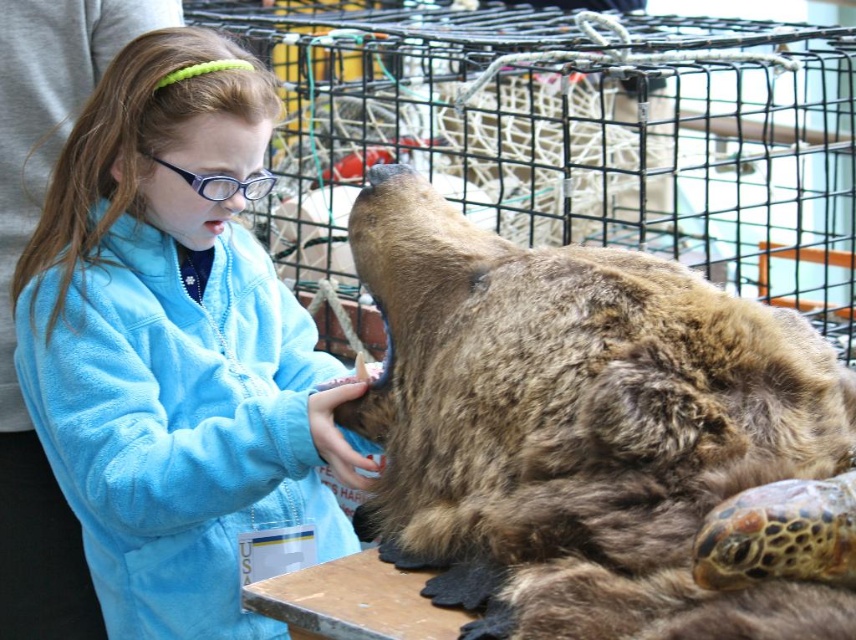
Question: Is brown furry bear at center above blue fleece jacket at upper left?

Choices:
 (A) yes
 (B) no

Answer: (B)

Question: Does brown furry bear at center have a smaller size compared to blue fleece jacket at upper left?

Choices:
 (A) no
 (B) yes

Answer: (A)

Question: Is brown furry bear at center wider than blue fleece jacket at upper left?

Choices:
 (A) yes
 (B) no

Answer: (A)

Question: Which of the following is the farthest from the observer?

Choices:
 (A) brown furry bear at center
 (B) blue fleece jacket at upper left

Answer: (B)